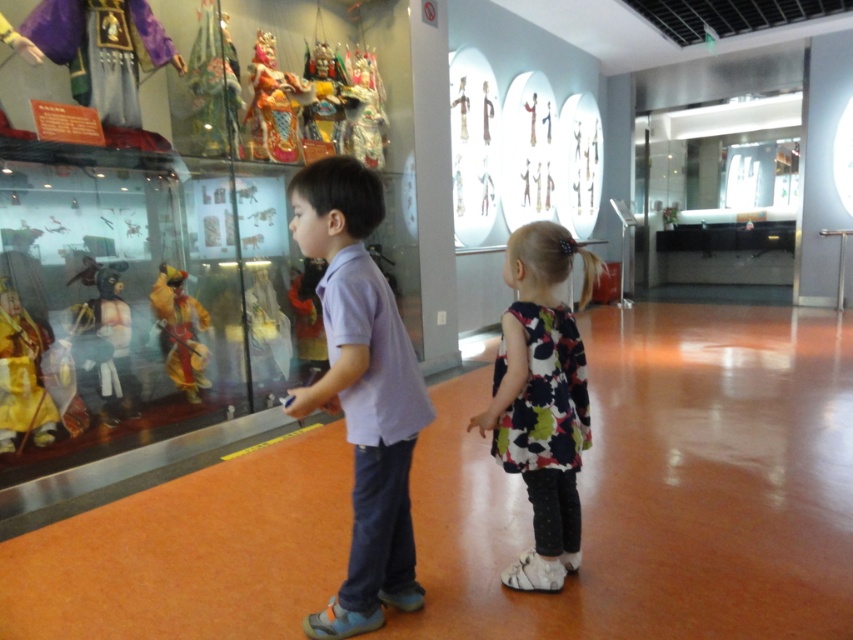
You are a tour guide leading a group through the museum. You need to ensure that visitors maintain a safe distance of at least 2 meters between themselves and the display case. The purple cotton shirt at center and the yellow fabric doll at left are part of the exhibit. Are the two objects currently positioned in a way that meets the safety requirement?

The purple cotton shirt at center is 1.90 meters from the yellow fabric doll at left. Since the required safe distance is 2 meters, the current distance of 1.90 meters does not meet the safety requirement. The objects are too close together.

From the picture: You are a photographer standing in the museum. You want to take a photo of the purple cotton shirt at center and the yellow fabric doll at left so that both are fully visible in the frame. Based on their heights, which object should be placed closer to the bottom of the photo to ensure both are visible?

The purple cotton shirt at center is taller than the yellow fabric doll at left, so to ensure both are fully visible in the photo, the yellow fabric doll at left should be placed closer to the bottom of the frame.

You are a photographer positioned in front of the museum display case. You want to take a photo focusing on the purple cotton shirt at center and the yellow fabric doll at left. Which object should you adjust your camera focus to first to ensure both are in sharp detail?

The purple cotton shirt at center is closer to the viewer than the yellow fabric doll at left, so you should focus on the purple cotton shirt at center first to ensure both are in sharp detail.